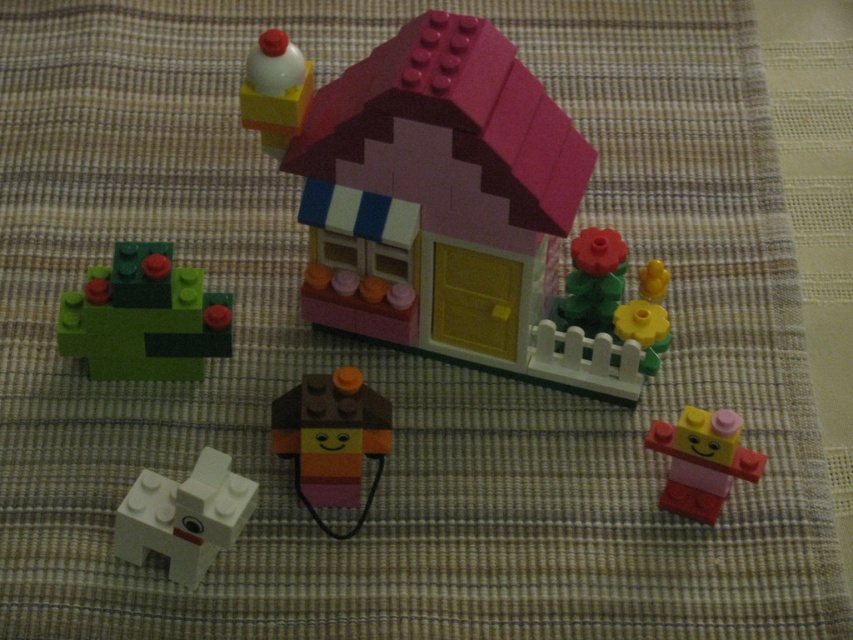
You are looking at the LEGO scene and want to place a new LEGO piece exactly at the location marked by the coordinates point (144, 317). Which object in the scene is already occupying that spot?

The green matte plant at lower left is located at point (144, 317), so that spot is already occupied by the green matte plant at lower left.

You are a LEGO designer trying to place a new LEGO piece at the coordinates point (144,317). Based on the scene description, what object is already located at that position?

The point (144,317) corresponds to the green matte plant at lower left.